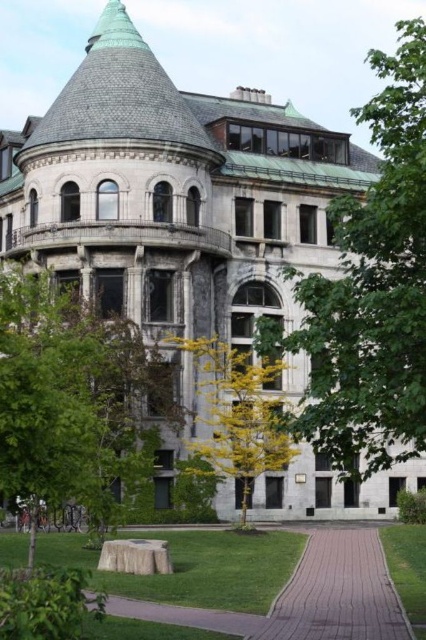
Is green leafy tree at upper center taller than yellow-green leaves at center?

Yes.

The image size is (426, 640). Identify the location of green leafy tree at upper center. (371, 291).

Who is higher up, brick paved path at center or yellow-green leaves at center?

yellow-green leaves at center is above.

Can you confirm if brick paved path at center is thinner than yellow-green leaves at center?

Indeed, brick paved path at center has a lesser width compared to yellow-green leaves at center.

This screenshot has height=640, width=426. What do you see at coordinates (337, 592) in the screenshot?
I see `brick paved path at center` at bounding box center [337, 592].

Identify the location of brick paved path at center. The height and width of the screenshot is (640, 426). (337, 592).

Is green leafy tree at upper center behind green leafy tree at lower left?

Yes, it is behind green leafy tree at lower left.

Who is positioned more to the left, green leafy tree at upper center or green leafy tree at lower left?

Positioned to the left is green leafy tree at lower left.

Image resolution: width=426 pixels, height=640 pixels. What do you see at coordinates (371, 291) in the screenshot?
I see `green leafy tree at upper center` at bounding box center [371, 291].

Find the location of a particular element. green leafy tree at upper center is located at coordinates (371, 291).